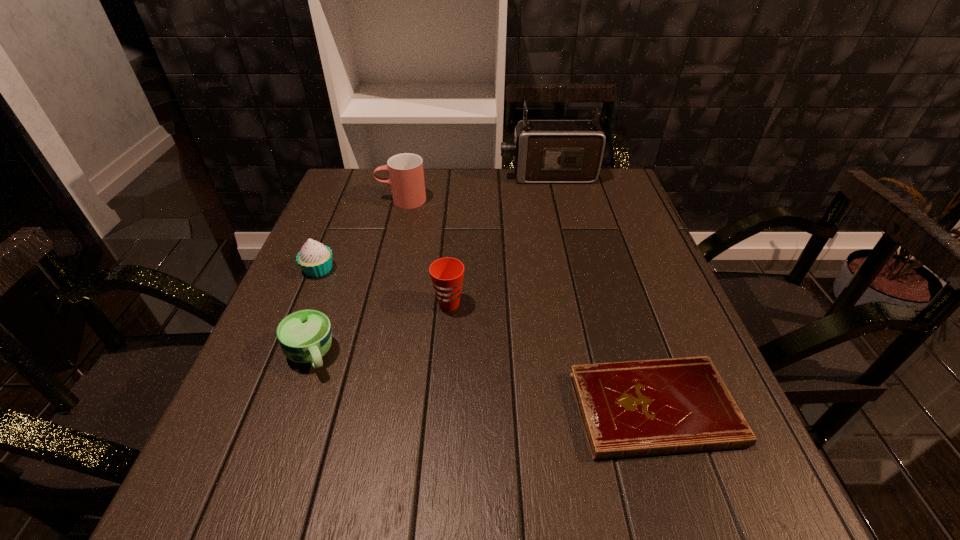
This screenshot has height=540, width=960. Find the location of `free space at the near left corner of the desktop`. free space at the near left corner of the desktop is located at coordinates click(x=228, y=481).

Where is `free space at the far right corner of the desktop`? Image resolution: width=960 pixels, height=540 pixels. free space at the far right corner of the desktop is located at coordinates (617, 176).

Identify the location of free space between the tallest cup and the cupcake. Image resolution: width=960 pixels, height=540 pixels. (360, 234).

Where is `vacant area that lies between the cupcake and the tallest object`? vacant area that lies between the cupcake and the tallest object is located at coordinates (433, 222).

Identify the location of vacant region between the tallest object and the fourth tallest object. The height and width of the screenshot is (540, 960). (433, 222).

Identify the location of vacant area between the nearest cup and the notebook. (482, 382).

Locate an element on the screen. The width and height of the screenshot is (960, 540). free space between the third shortest object and the notebook is located at coordinates (486, 339).

The image size is (960, 540). Find the location of `free point between the rightmost cup and the notebook`. free point between the rightmost cup and the notebook is located at coordinates (551, 356).

Find the location of a particular element. free space between the farthest cup and the farthest object is located at coordinates (475, 188).

Find the location of `free space that is in between the second farthest object and the fourth object from left to right`. free space that is in between the second farthest object and the fourth object from left to right is located at coordinates (425, 252).